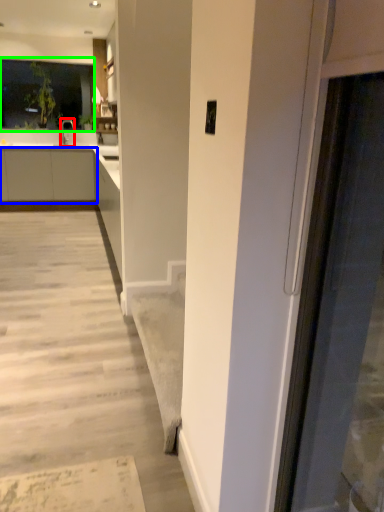
Question: Based on their relative distances, which object is farther from tap (highlighted by a red box)? Choose from cabinetry (highlighted by a blue box) and window (highlighted by a green box).

Choices:
 (A) cabinetry
 (B) window

Answer: (A)